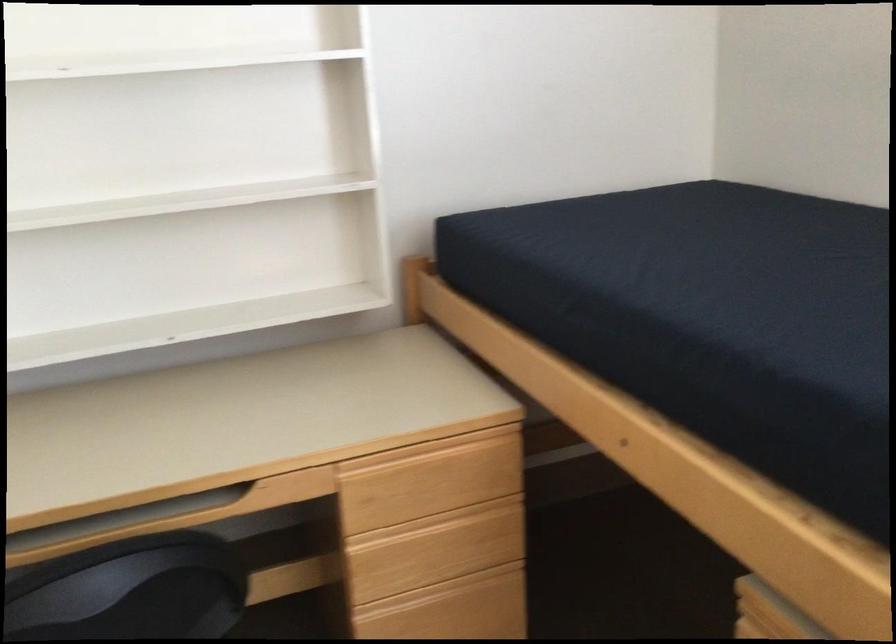
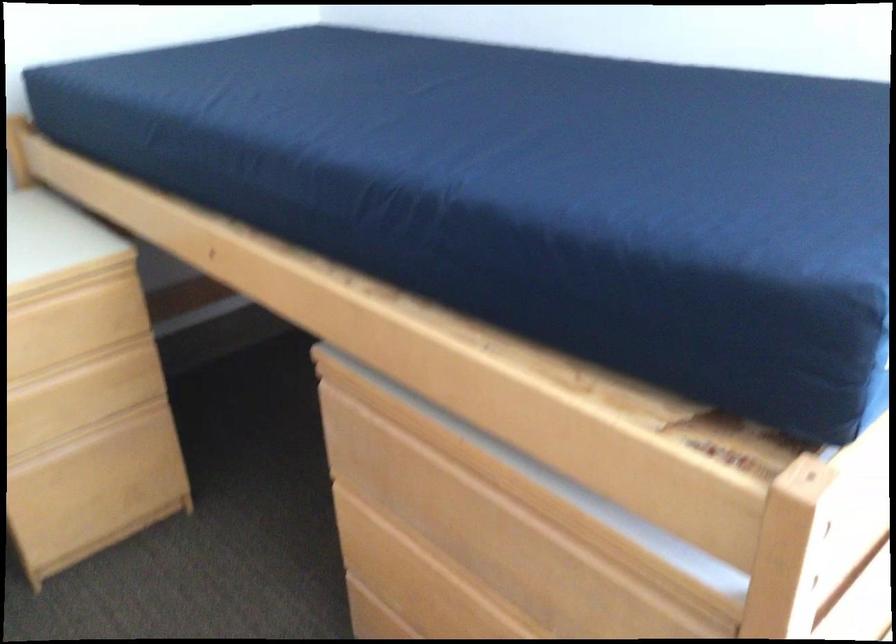
In the second image, find the point that corresponds to (x=428, y=558) in the first image.

(65, 410)